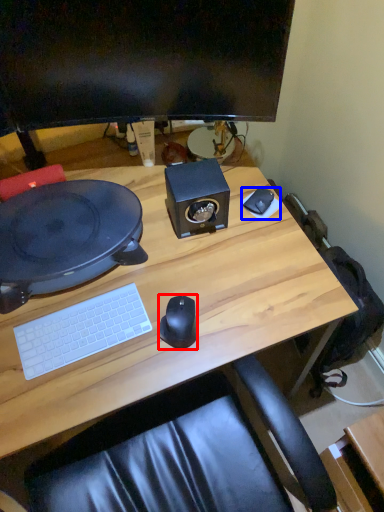
Question: Among these objects, which one is nearest to the camera, mouse (highlighted by a red box) or mousepad (highlighted by a blue box)?

Choices:
 (A) mouse
 (B) mousepad

Answer: (A)